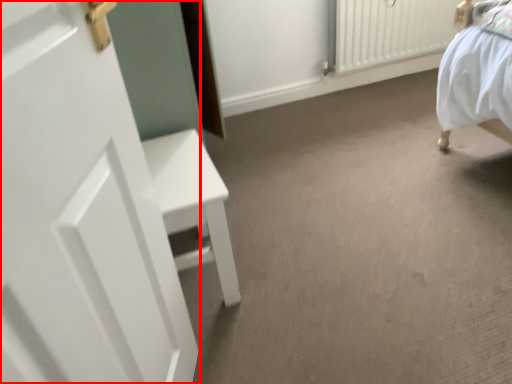
Question: In this image, where is door (annotated by the red box) located relative to radiator?

Choices:
 (A) right
 (B) left

Answer: (B)